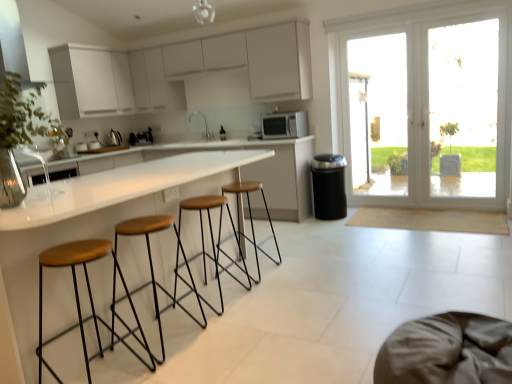
Locate an element on the screen. The width and height of the screenshot is (512, 384). free space above white glossy sink at center (from a real-world perspective) is located at coordinates (202, 107).